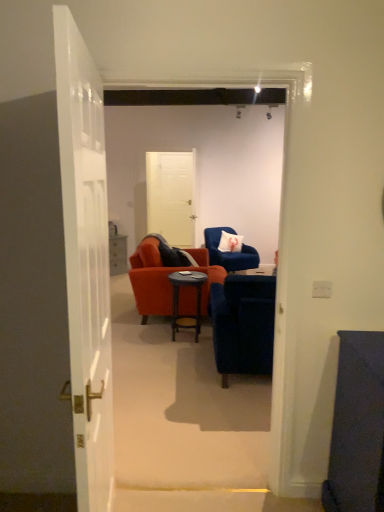
What are the coordinates of `vacant area situated to the left side of dark wood side table at center` in the screenshot? It's located at [x=152, y=337].